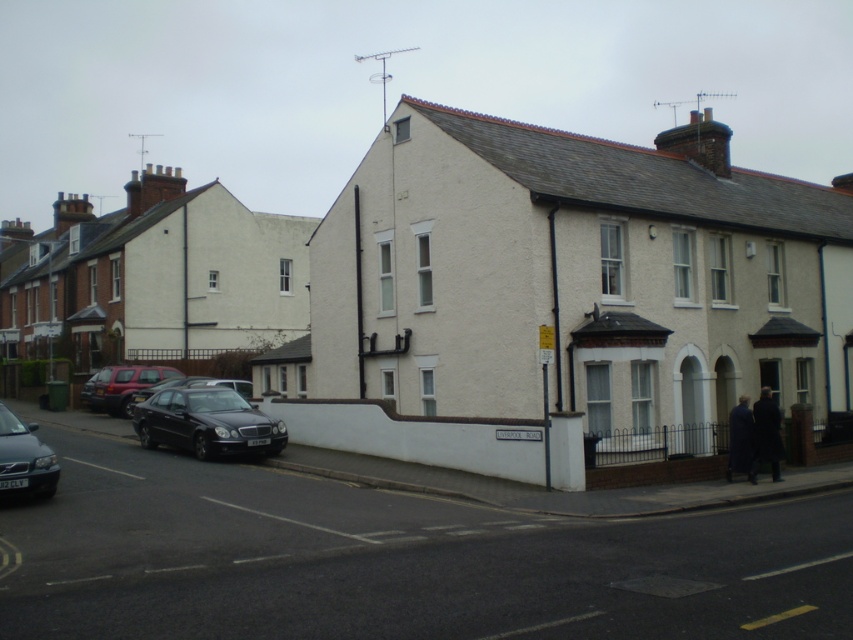
Question: From the image, what is the correct spatial relationship of matte black car at lower left in relation to shiny black sedan at center-left?

Choices:
 (A) below
 (B) above

Answer: (A)

Question: Is shiny black sedan at lower left positioned before matte red car at lower left?

Choices:
 (A) no
 (B) yes

Answer: (B)

Question: Is matte black car at lower left in front of matte red car at lower left?

Choices:
 (A) yes
 (B) no

Answer: (A)

Question: Which object appears farthest from the camera in this image?

Choices:
 (A) matte black car at lower left
 (B) shiny black sedan at lower left

Answer: (B)

Question: Which point is closer to the camera?

Choices:
 (A) shiny black sedan at lower left
 (B) matte black car at lower left

Answer: (B)

Question: Which of the following is the closest to the observer?

Choices:
 (A) matte red car at lower left
 (B) shiny black sedan at center-left
 (C) matte black car at lower left
 (D) shiny black sedan at lower left

Answer: (C)